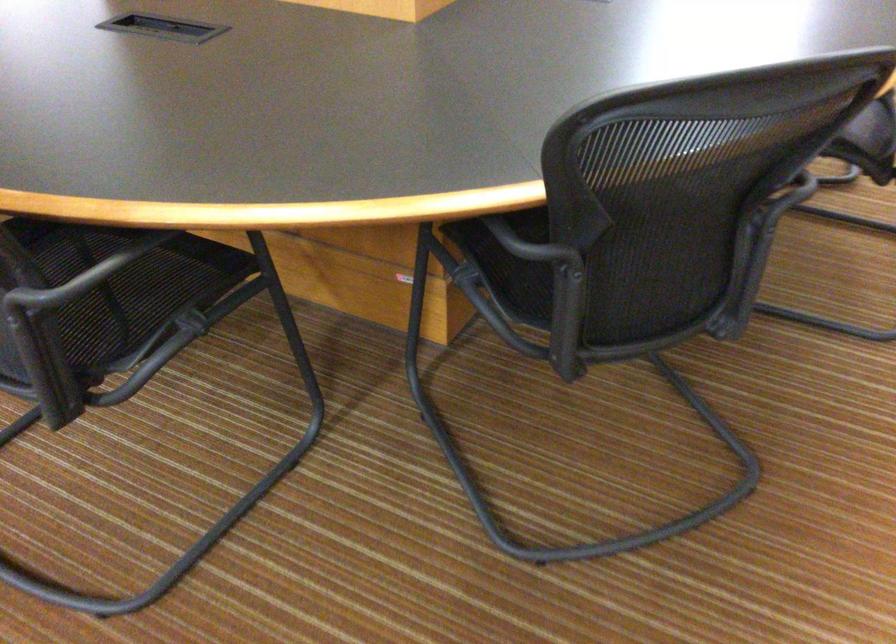
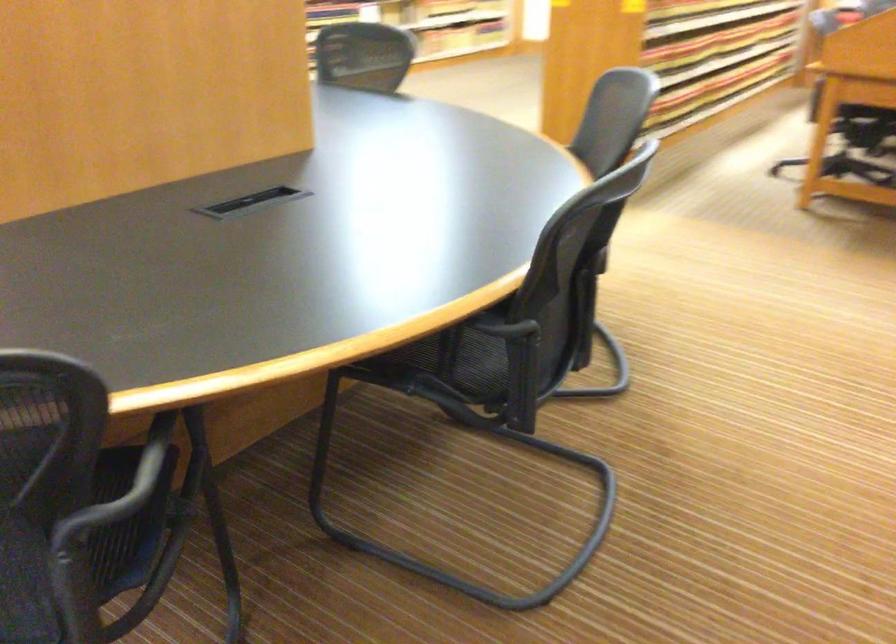
Question: The images are taken continuously from a first-person perspective. In which direction is your viewpoint rotating?

Choices:
 (A) Left
 (B) Right
 (C) Up
 (D) Down

Answer: (C)